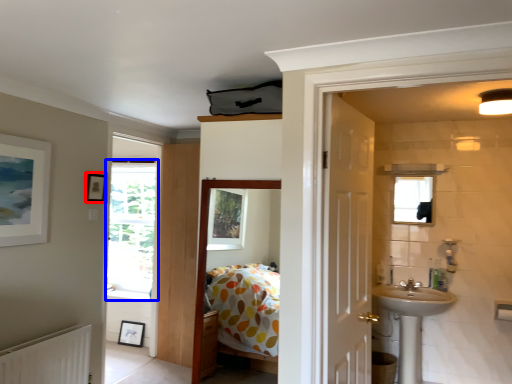
Question: Which object appears closest to the camera in this image, picture frame (highlighted by a red box) or window (highlighted by a blue box)?

Choices:
 (A) picture frame
 (B) window

Answer: (A)